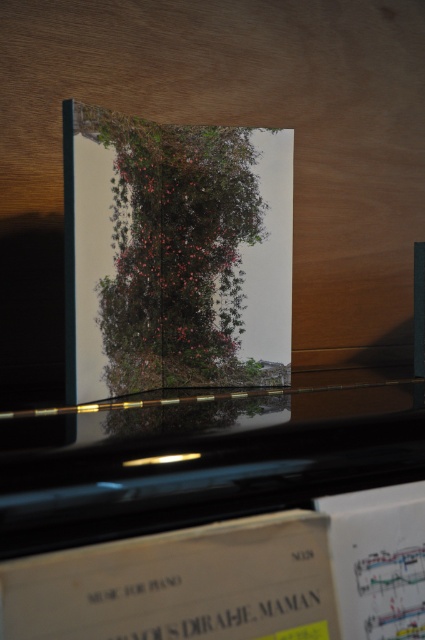
Question: Does black glossy piano at upper center come in front of green leafy plant at center?

Choices:
 (A) yes
 (B) no

Answer: (A)

Question: Where is black glossy piano at upper center located in relation to white paper music at lower center in the image?

Choices:
 (A) below
 (B) above

Answer: (B)

Question: Is green leafy plant at center in front of white paper music at lower center?

Choices:
 (A) yes
 (B) no

Answer: (B)

Question: Which of these objects is positioned farthest from the white paper music at lower center?

Choices:
 (A) green leafy plant at center
 (B) black glossy piano at upper center

Answer: (A)

Question: Which of these objects is positioned closest to the white paper music at lower center?

Choices:
 (A) white paper music at lower right
 (B) green leafy plant at center

Answer: (A)

Question: Which point is closer to the camera taking this photo?

Choices:
 (A) (371, 630)
 (B) (158, 208)

Answer: (A)